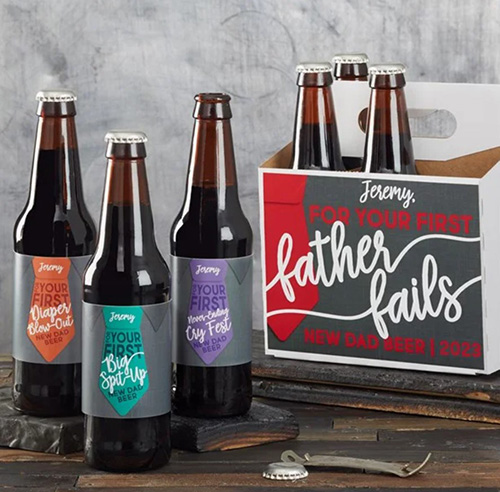
Where is `box for beer`? Image resolution: width=500 pixels, height=492 pixels. box for beer is located at coordinates (466, 189).